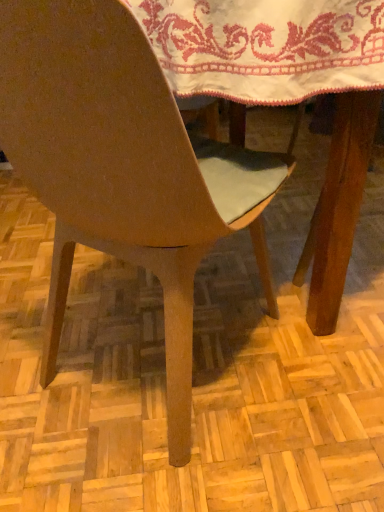
The height and width of the screenshot is (512, 384). Find the location of `matte wood chair at center`. matte wood chair at center is located at coordinates (123, 168).

This screenshot has height=512, width=384. What do you see at coordinates (123, 168) in the screenshot?
I see `matte wood chair at center` at bounding box center [123, 168].

What are the coordinates of `white embroidered cloth at upper center` in the screenshot? It's located at (266, 46).

What do you see at coordinates (266, 46) in the screenshot? I see `white embroidered cloth at upper center` at bounding box center [266, 46].

Locate an element on the screen. The height and width of the screenshot is (512, 384). matte wood chair at center is located at coordinates (123, 168).

Considering the relative positions of matte wood chair at center and white embroidered cloth at upper center in the image provided, is matte wood chair at center to the right of white embroidered cloth at upper center from the viewer's perspective?

In fact, matte wood chair at center is to the left of white embroidered cloth at upper center.

Which object is further away from the camera taking this photo, matte wood chair at center or white embroidered cloth at upper center?

Positioned behind is white embroidered cloth at upper center.

Considering the points (32, 42) and (198, 61), which point is behind, point (32, 42) or point (198, 61)?

Positioned behind is point (198, 61).

From the image's perspective, who appears lower, matte wood chair at center or white embroidered cloth at upper center?

matte wood chair at center, from the image's perspective.

From a real-world perspective, is matte wood chair at center on white embroidered cloth at upper center?

No, from a real-world perspective, matte wood chair at center is not above white embroidered cloth at upper center.

Considering the sizes of objects matte wood chair at center and white embroidered cloth at upper center in the image provided, who is wider, matte wood chair at center or white embroidered cloth at upper center?

With larger width is white embroidered cloth at upper center.

Considering the sizes of objects matte wood chair at center and white embroidered cloth at upper center in the image provided, who is taller, matte wood chair at center or white embroidered cloth at upper center?

matte wood chair at center is taller.

Considering the relative sizes of matte wood chair at center and white embroidered cloth at upper center in the image provided, is matte wood chair at center bigger than white embroidered cloth at upper center?

Yes, matte wood chair at center is bigger than white embroidered cloth at upper center.

Is matte wood chair at center positioned beyond the bounds of white embroidered cloth at upper center?

matte wood chair at center is positioned outside white embroidered cloth at upper center.

Are matte wood chair at center and white embroidered cloth at upper center located far from each other?

No, there isn't a large distance between matte wood chair at center and white embroidered cloth at upper center.

Is matte wood chair at center positioned with its back to white embroidered cloth at upper center?

No, white embroidered cloth at upper center is not at the back of matte wood chair at center.

Can you tell me how much matte wood chair at center and white embroidered cloth at upper center differ in facing direction?

The angle between the facing direction of matte wood chair at center and the facing direction of white embroidered cloth at upper center is 180 degrees.

Locate an element on the screen. This screenshot has width=384, height=512. chair below the white embroidered cloth at upper center (from the image's perspective) is located at coordinates (123, 168).

Which object is positioned more to the left, white embroidered cloth at upper center or matte wood chair at center?

From the viewer's perspective, matte wood chair at center appears more on the left side.

Between white embroidered cloth at upper center and matte wood chair at center, which one is positioned behind?

white embroidered cloth at upper center is more distant.

Is point (297, 46) less distant than point (90, 123)?

No, (297, 46) is behind (90, 123).

From the image's perspective, is white embroidered cloth at upper center beneath matte wood chair at center?

No, from the image's perspective, white embroidered cloth at upper center is not beneath matte wood chair at center.

From a real-world perspective, is white embroidered cloth at upper center above or below matte wood chair at center?

From a real-world perspective, white embroidered cloth at upper center is physically above matte wood chair at center.

Between white embroidered cloth at upper center and matte wood chair at center, which one has larger width?

white embroidered cloth at upper center.

Considering the relative sizes of white embroidered cloth at upper center and matte wood chair at center in the image provided, is white embroidered cloth at upper center taller than matte wood chair at center?

No, white embroidered cloth at upper center is not taller than matte wood chair at center.

Is white embroidered cloth at upper center bigger than matte wood chair at center?

No, white embroidered cloth at upper center is not bigger than matte wood chair at center.

Is white embroidered cloth at upper center outside of matte wood chair at center?

Yes, white embroidered cloth at upper center is located beyond the bounds of matte wood chair at center.

Is white embroidered cloth at upper center next to matte wood chair at center?

No, white embroidered cloth at upper center is not touching matte wood chair at center.

Is white embroidered cloth at upper center turned away from matte wood chair at center?

No, matte wood chair at center is not at the back of white embroidered cloth at upper center.

From the picture: How many degrees apart are the facing directions of white embroidered cloth at upper center and matte wood chair at center?

180 degrees separate the facing orientations of white embroidered cloth at upper center and matte wood chair at center.

How far apart are white embroidered cloth at upper center and matte wood chair at center?

white embroidered cloth at upper center and matte wood chair at center are 24.94 centimeters apart from each other.

Locate an element on the screen. This screenshot has width=384, height=512. tablecloth behind the matte wood chair at center is located at coordinates (266, 46).

In order to click on tablecloth behind the matte wood chair at center in this screenshot , I will do `click(266, 46)`.

Locate an element on the screen. tablecloth above the matte wood chair at center (from a real-world perspective) is located at coordinates (266, 46).